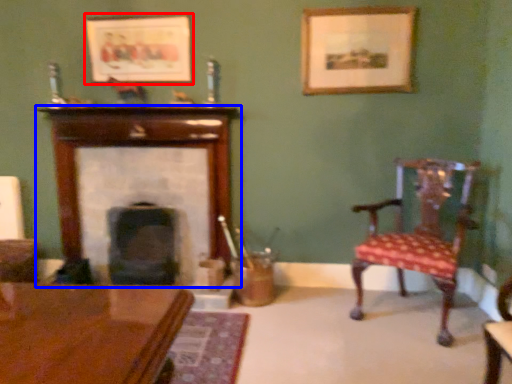
Question: Among these objects, which one is nearest to the camera, picture frame (highlighted by a red box) or fireplace (highlighted by a blue box)?

Choices:
 (A) picture frame
 (B) fireplace

Answer: (A)